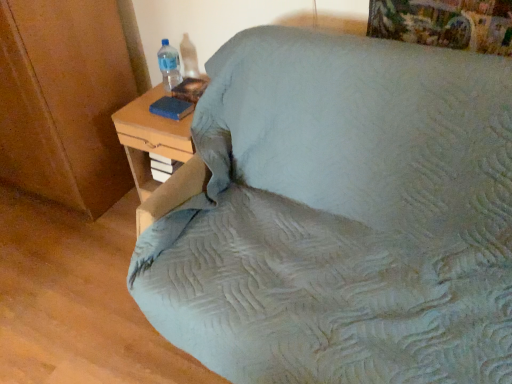
Where is `vacant region in front of blue matte book at upper left`? This screenshot has width=512, height=384. vacant region in front of blue matte book at upper left is located at coordinates (168, 126).